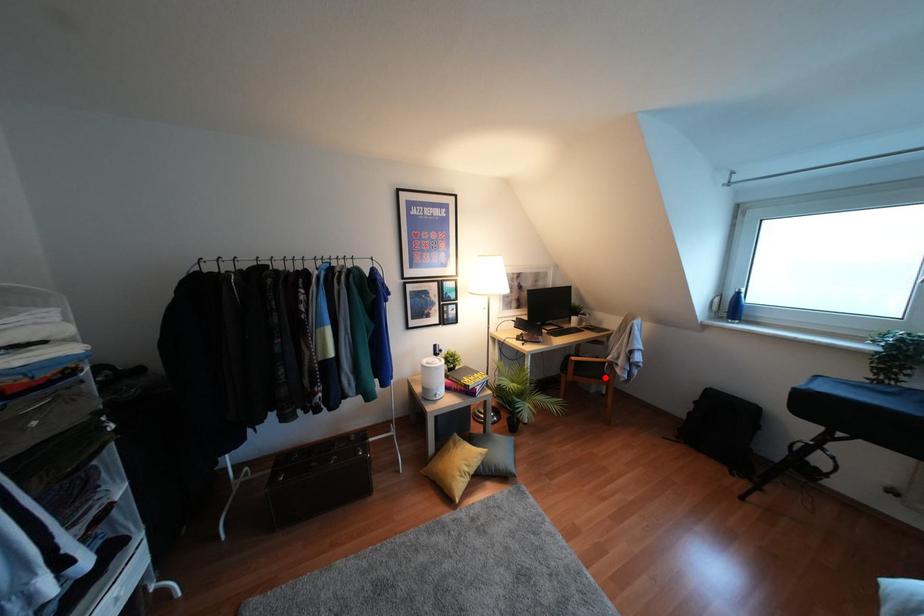
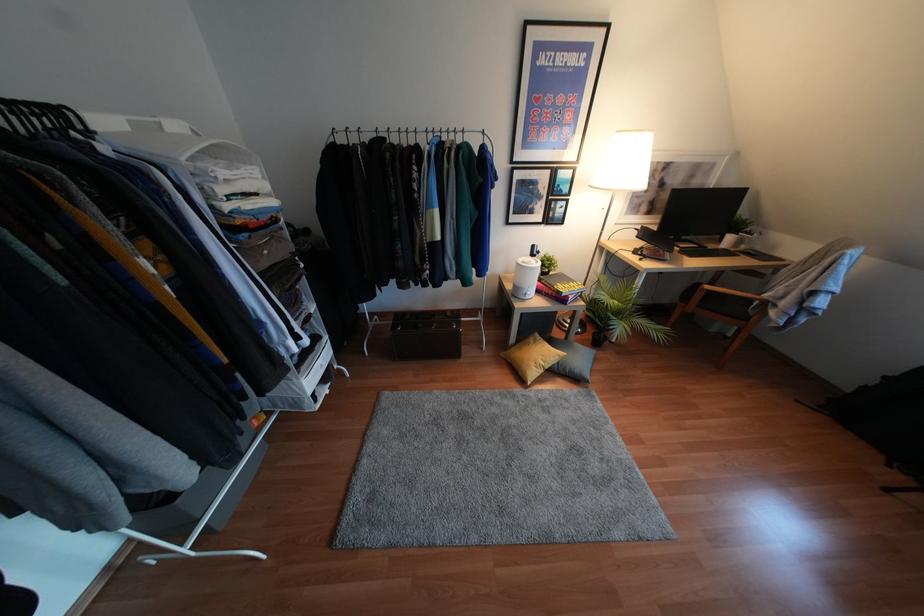
In the second image, find the point that corresponds to the highlighted location in the first image.

(745, 318)